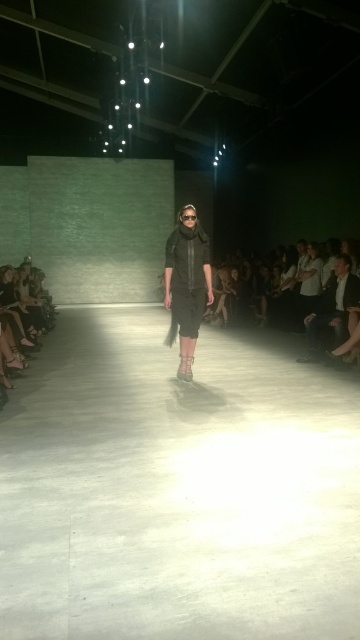
You are a photographer positioned at the end of the runway. You need to take a photo of the black matte dress at center. Where should you aim your camera to capture the dress in the frame?

You should aim your camera at the point 0.445 on the x axis and 0.519 on the y axis to capture the black matte dress at center.

You are a photographer at the fashion show. You need to capture a photo that includes both the black matte dress at center and the dark gray jeans at right. Which one should you position on the left side of your frame to ensure both are visible?

The black matte dress at center is already positioned on the left side of the dark gray jeans at right, so you should keep the black matte dress at center on the left side of your frame to ensure both are visible.